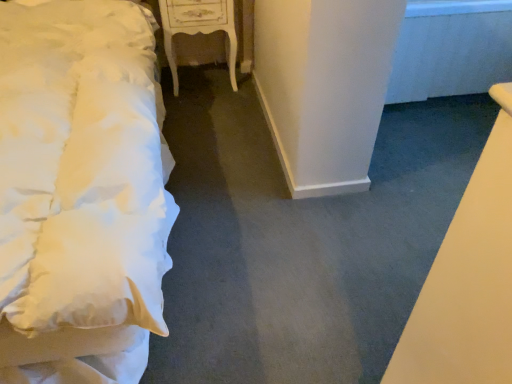
What do you see at coordinates (81, 192) in the screenshot?
I see `white soft bed at left` at bounding box center [81, 192].

Image resolution: width=512 pixels, height=384 pixels. What are the coordinates of `white soft bed at left` in the screenshot? It's located at (81, 192).

Measure the distance between point (145,204) and camera.

Point (145,204) is 1.06 meters away from camera.

The width and height of the screenshot is (512, 384). What are the coordinates of `white glossy nightstand at center` in the screenshot? It's located at (198, 28).

Measure the distance between white glossy nightstand at center and camera.

white glossy nightstand at center and camera are 7.18 feet apart.

The height and width of the screenshot is (384, 512). Describe the element at coordinates (198, 28) in the screenshot. I see `white glossy nightstand at center` at that location.

This screenshot has width=512, height=384. In order to click on white soft bed at left in this screenshot , I will do `click(81, 192)`.

Can you confirm if white soft bed at left is positioned to the left of white glossy nightstand at center?

Yes, white soft bed at left is to the left of white glossy nightstand at center.

Considering the relative positions of white soft bed at left and white glossy nightstand at center in the image provided, is white soft bed at left behind white glossy nightstand at center?

That is False.

Does point (106, 324) come in front of point (231, 38)?

Yes, point (106, 324) is in front of point (231, 38).

From the image's perspective, does white soft bed at left appear higher than white glossy nightstand at center?

Incorrect, from the image's perspective, white soft bed at left is lower than white glossy nightstand at center.

From a real-world perspective, which is physically above, white soft bed at left or white glossy nightstand at center?

white soft bed at left is physically above.

Between white soft bed at left and white glossy nightstand at center, which one has larger width?

Wider between the two is white soft bed at left.

Considering the relative sizes of white soft bed at left and white glossy nightstand at center in the image provided, is white soft bed at left taller than white glossy nightstand at center?

Correct, white soft bed at left is much taller as white glossy nightstand at center.

Considering the sizes of objects white soft bed at left and white glossy nightstand at center in the image provided, who is bigger, white soft bed at left or white glossy nightstand at center?

white soft bed at left is bigger.

From the picture: Is white soft bed at left outside of white glossy nightstand at center?

That's correct, white soft bed at left is outside of white glossy nightstand at center.

Is white soft bed at left touching white glossy nightstand at center?

No, white soft bed at left is not next to white glossy nightstand at center.

Could you tell me if white soft bed at left is turned towards white glossy nightstand at center?

No, white soft bed at left is not facing towards white glossy nightstand at center.

Based on the photo, how different are the orientations of white soft bed at left and white glossy nightstand at center in degrees?

There is a 0.883-degree angle between the facing directions of white soft bed at left and white glossy nightstand at center.

How much distance is there between white soft bed at left and white glossy nightstand at center?

A distance of 34.14 inches exists between white soft bed at left and white glossy nightstand at center.

Identify the location of furniture below the white soft bed at left (from a real-world perspective). (198, 28).

Does white glossy nightstand at center appear on the left side of white soft bed at left?

In fact, white glossy nightstand at center is to the right of white soft bed at left.

Between white glossy nightstand at center and white soft bed at left, which one is positioned in front?

white soft bed at left is closer to the camera.

Considering the positions of points (183, 14) and (87, 232), is point (183, 14) farther from camera compared to point (87, 232)?

Yes, it is.

From the image's perspective, is white glossy nightstand at center located above or below white soft bed at left?

white glossy nightstand at center is situated higher than white soft bed at left in the image.

Looking at this image, from a real-world perspective, does white glossy nightstand at center sit lower than white soft bed at left?

Yes.

Can you confirm if white glossy nightstand at center is wider than white soft bed at left?

No, white glossy nightstand at center is not wider than white soft bed at left.

Between white glossy nightstand at center and white soft bed at left, which one has less height?

Standing shorter between the two is white glossy nightstand at center.

Is white glossy nightstand at center bigger than white soft bed at left?

No, white glossy nightstand at center is not bigger than white soft bed at left.

Is white glossy nightstand at center positioned beyond the bounds of white soft bed at left?

Yes, white glossy nightstand at center is located beyond the bounds of white soft bed at left.

Is white glossy nightstand at center far from white soft bed at left?

No, white glossy nightstand at center is in close proximity to white soft bed at left.

Is white glossy nightstand at center positioned with its back to white soft bed at left?

No, white soft bed at left is not at the back of white glossy nightstand at center.

What's the angular difference between white glossy nightstand at center and white soft bed at left's facing directions?

The facing directions of white glossy nightstand at center and white soft bed at left are 0.883 degrees apart.

Measure the distance between white glossy nightstand at center and white soft bed at left.

They are 86.71 centimeters apart.

Locate an element on the screen. This screenshot has height=384, width=512. bed that appears on the left of white glossy nightstand at center is located at coordinates (81, 192).

At what (x,y) coordinates should I click in order to perform the action: click on furniture behind the white soft bed at left. Please return your answer as a coordinate pair (x, y). Image resolution: width=512 pixels, height=384 pixels. Looking at the image, I should click on (198, 28).

You are a GUI agent. You are given a task and a screenshot of the screen. Output one action in this format:
    pyautogui.click(x=<x>, y=<y>)
    Task: Click on the furniture on the right of white soft bed at left
    This screenshot has height=384, width=512.
    Given the screenshot: What is the action you would take?
    pyautogui.click(x=198, y=28)